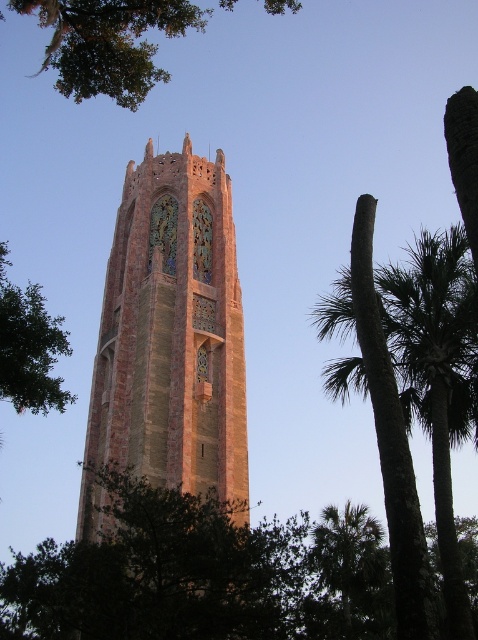
Between green leafy palm tree at right and green leafy tree at left, which one has more height?

Standing taller between the two is green leafy palm tree at right.

Is green leafy palm tree at right thinner than green leafy tree at left?

Yes, green leafy palm tree at right is thinner than green leafy tree at left.

In order to click on green leafy palm tree at right in this screenshot , I will do `click(390, 440)`.

Measure the distance between point [119,316] and camera.

The distance of point [119,316] from camera is 65.83 meters.

Who is positioned more to the left, brick tower at center or green leafy palm tree at lower right?

brick tower at center is more to the left.

Who is more distant from viewer, (209, 234) or (379, 609)?

Point (209, 234)

The image size is (478, 640). I want to click on brick tower at center, so click(170, 340).

You are a GUI agent. You are given a task and a screenshot of the screen. Output one action in this format:
    pyautogui.click(x=<x>, y=<y>)
    Task: Click on the green leafy palm tree at right
    
    Given the screenshot: What is the action you would take?
    pyautogui.click(x=390, y=440)

Which is above, green leafy palm tree at right or green leafy palm tree at lower right?

green leafy palm tree at right is above.

Describe the element at coordinates (390, 440) in the screenshot. The height and width of the screenshot is (640, 478). I see `green leafy palm tree at right` at that location.

I want to click on green leafy palm tree at right, so click(390, 440).